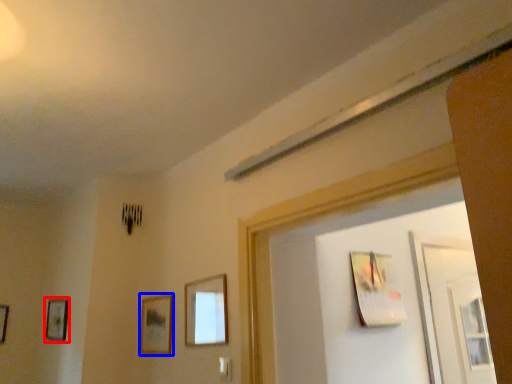
Question: Which object appears farthest to the camera in this image, picture frame (highlighted by a red box) or picture frame (highlighted by a blue box)?

Choices:
 (A) picture frame
 (B) picture frame

Answer: (A)